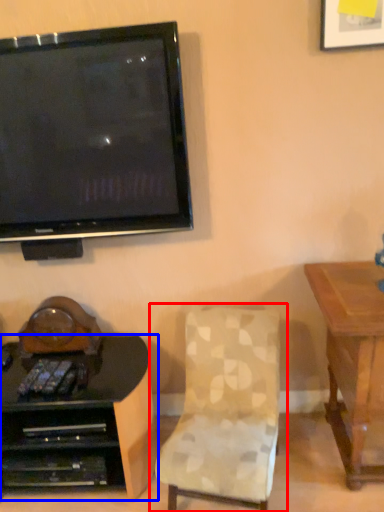
Question: Which object is closer to the camera taking this photo, chair (highlighted by a red box) or desk (highlighted by a blue box)?

Choices:
 (A) chair
 (B) desk

Answer: (A)